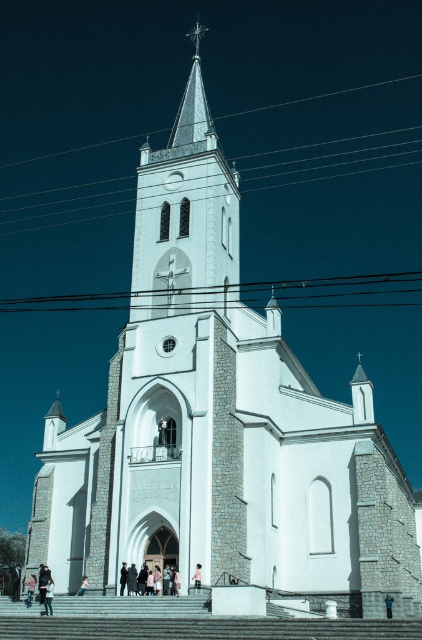
Question: Does smooth concrete stairs at center have a larger size compared to dark gray coat at center?

Choices:
 (A) yes
 (B) no

Answer: (A)

Question: Which point is farther to the camera?

Choices:
 (A) (238, 241)
 (B) (199, 572)

Answer: (A)

Question: Considering the real-world distances, which object is closest to the black wire at upper center?

Choices:
 (A) dark gray coat at center
 (B) dark brown leather jacket at lower center

Answer: (A)

Question: Which point is farther to the camera?

Choices:
 (A) tap(191, 141)
 (B) tap(32, 586)

Answer: (A)

Question: Observing the image, what is the correct spatial positioning of shiny silver spire at upper center in reference to pink fabric person at center?

Choices:
 (A) right
 (B) left

Answer: (B)

Question: Is the position of white stone steeple at center more distant than that of shiny silver spire at upper center?

Choices:
 (A) no
 (B) yes

Answer: (A)